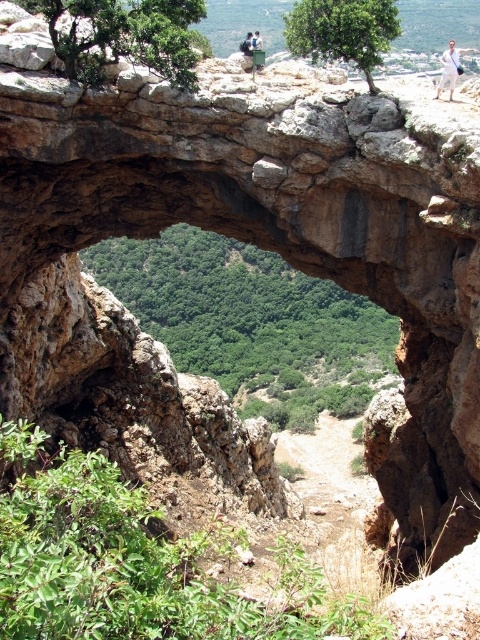
Is green leafy tree at center shorter than white cotton pants at upper right?

Correct, green leafy tree at center is not as tall as white cotton pants at upper right.

Who is more forward, [218,339] or [444,77]?

Point [444,77] is more forward.

Describe the element at coordinates (250, 321) in the screenshot. I see `green leafy tree at center` at that location.

Find the location of a particular element. The width and height of the screenshot is (480, 640). green leafy tree at center is located at coordinates (250, 321).

Between white cotton pants at upper right and white cotton shirt at upper center, which one is positioned lower?

white cotton pants at upper right is below.

Is point (444, 80) less distant than point (260, 38)?

Yes, point (444, 80) is in front of point (260, 38).

The image size is (480, 640). In order to click on white cotton pants at upper right in this screenshot , I will do `click(448, 68)`.

Between point (446, 60) and point (244, 51), which one is positioned in front?

Point (446, 60) is in front.

Is point (453, 58) in front of point (245, 42)?

Yes, point (453, 58) is closer to viewer.

The height and width of the screenshot is (640, 480). Find the location of `white cotton pants at upper right`. white cotton pants at upper right is located at coordinates (448, 68).